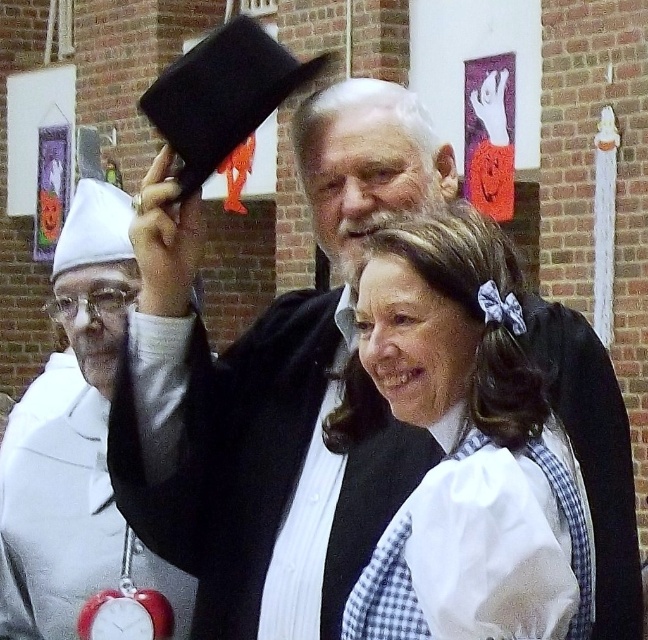
Between matte black hat at upper center and white gingham dress at center, which one appears on the left side from the viewer's perspective?

From the viewer's perspective, white gingham dress at center appears more on the left side.

Is point (139, 448) behind point (365, 579)?

Yes.

You are a GUI agent. You are given a task and a screenshot of the screen. Output one action in this format:
    pyautogui.click(x=<x>, y=<y>)
    Task: Click on the matte black hat at upper center
    The image size is (648, 640).
    Given the screenshot: What is the action you would take?
    pos(246,445)

Who is more distant from viewer, (x=178, y=429) or (x=64, y=330)?

Point (x=64, y=330)

Is point (213, 492) positioned after point (89, 237)?

No, it is in front of (89, 237).

Which is behind, point (314, 324) or point (49, 314)?

Positioned behind is point (49, 314).

What are the coordinates of `matte black hat at upper center` in the screenshot? It's located at point(246,445).

Does white gingham dress at center appear over white cloth hat at left?

No, white gingham dress at center is not above white cloth hat at left.

Between white gingham dress at center and white cloth hat at left, which one is positioned lower?

white gingham dress at center is below.

Does point (483, 545) lie behind point (130, 221)?

No, (483, 545) is in front of (130, 221).

Where is `white gingham dress at center`? white gingham dress at center is located at coordinates (463, 445).